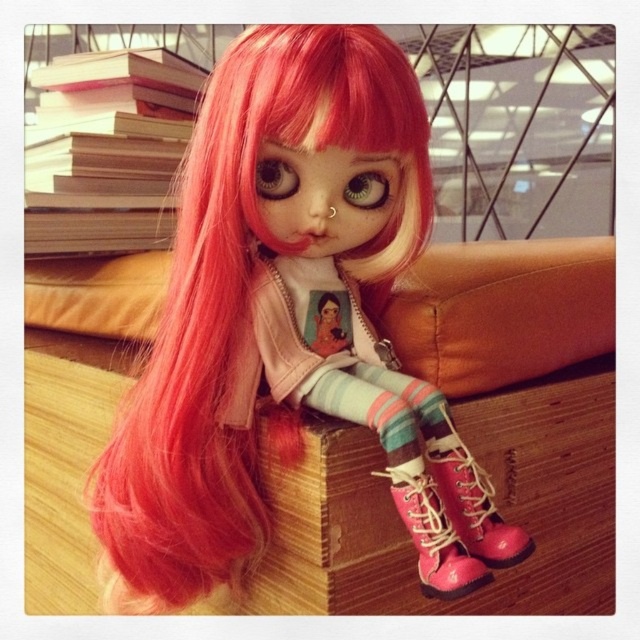
You are a photographer trying to capture the doll from a specific angle. The point at coordinates (289, 323) is crucial for framing the shot. Based on the scene description, where exactly is this point located?

The point at coordinates (289, 323) is located on the pink matte wig at upper left of the doll.

In the scene shown: You are a photographer standing at a certain distance from the doll. You want to take a closeup shot of the pink matte wig at upper left without including any other objects in the frame. Is the wig close enough to focus on clearly?

The pink matte wig at upper left is 50.55 centimeters away from viewer, so it is close enough to focus on clearly for a closeup shot without including other objects.

You are organizing a doll display and need to place the pink matte wig at upper left and the pink leather boot at lower center in a row. Based on their positions in the image, which object should be placed first from the left side?

The pink matte wig at upper left should be placed first from the left side because it is positioned to the left of the pink leather boot at lower center in the image.